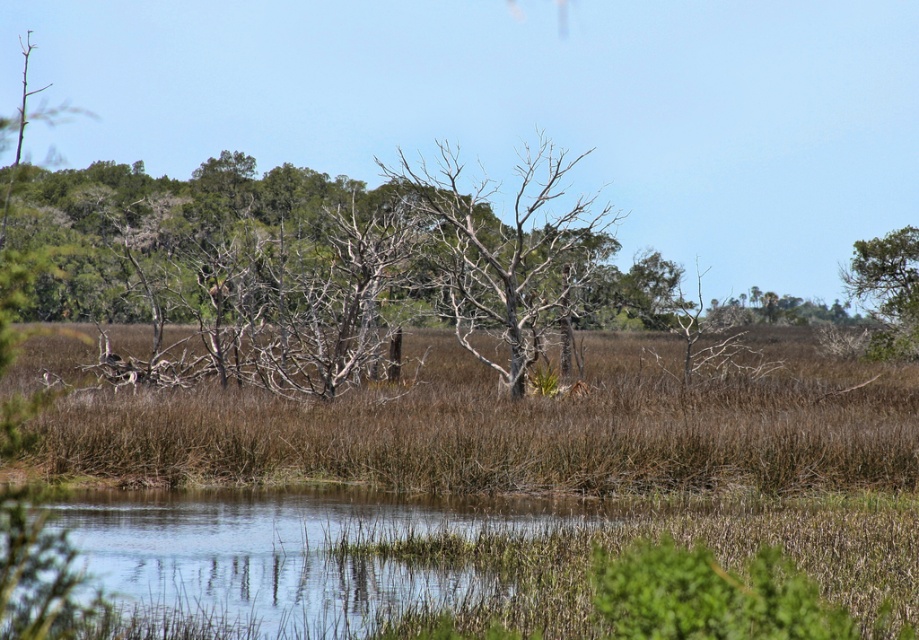
Which is more to the right, bare wood tree at center or green leafy tree at upper right?

Positioned to the right is green leafy tree at upper right.

Is point (551, 211) less distant than point (903, 236)?

Yes, point (551, 211) is in front of point (903, 236).

Image resolution: width=919 pixels, height=640 pixels. I want to click on bare wood tree at center, so click(506, 248).